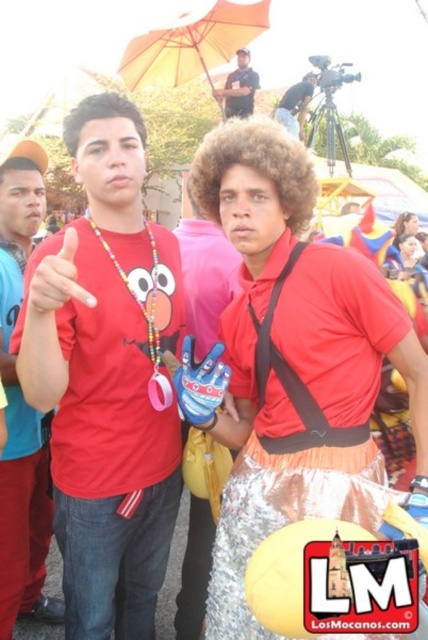
You are standing at the festival and want to take a photo of the person in the red tshirt with cartoon character design and the person in the metallic skirt. The camera you have can focus on objects up to 10 meters away. Is the point at coordinates point [196,563] within the camera focus range?

The point at coordinates point [196,563] is 9.14 meters from the viewer. Since the camera can focus up to 10 meters, the point is within the camera focus range.

You are a photographer at the festival and want to capture a photo of the two costumed individuals. You notice a matte black shirt at upper center located at point (238, 88). Will this object be in the frame if you focus on the two people in the foreground?

The matte black shirt at upper center is located at point (238, 88), which is in the background of the scene. Since the two costumed individuals are in the foreground, the matte black shirt at upper center will not be in the frame when focusing on them.

You are a photographer at the festival trying to capture the shiny metallic skirt at center and the brushed metal necklace at left. Which object will reflect more light in your photo?

The shiny metallic skirt at center will reflect more light in the photo because it is in front of the brushed metal necklace at left, making it more prominent and reflective in the image.